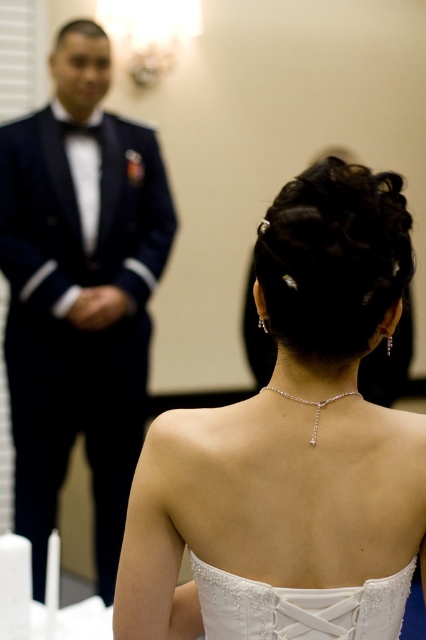
Does white satin dress at center have a greater width compared to white lace dress at back?

Indeed, white satin dress at center has a greater width compared to white lace dress at back.

Locate an element on the screen. The image size is (426, 640). white satin dress at center is located at coordinates (291, 448).

Which is more to the right, shiny black suit at left or white lace dress at back?

white lace dress at back is more to the right.

Looking at this image, between shiny black suit at left and white lace dress at back, which one has more height?

shiny black suit at left is taller.

Where is `shiny black suit at left`? shiny black suit at left is located at coordinates (78, 292).

Is the position of white satin dress at center less distant than that of shiny black suit at left?

That is True.

Which is in front, point (296, 612) or point (100, 531)?

Point (296, 612) is in front.

At what (x,y) coordinates should I click in order to perform the action: click on white satin dress at center. Please return your answer as a coordinate pair (x, y). Looking at the image, I should click on (291, 448).